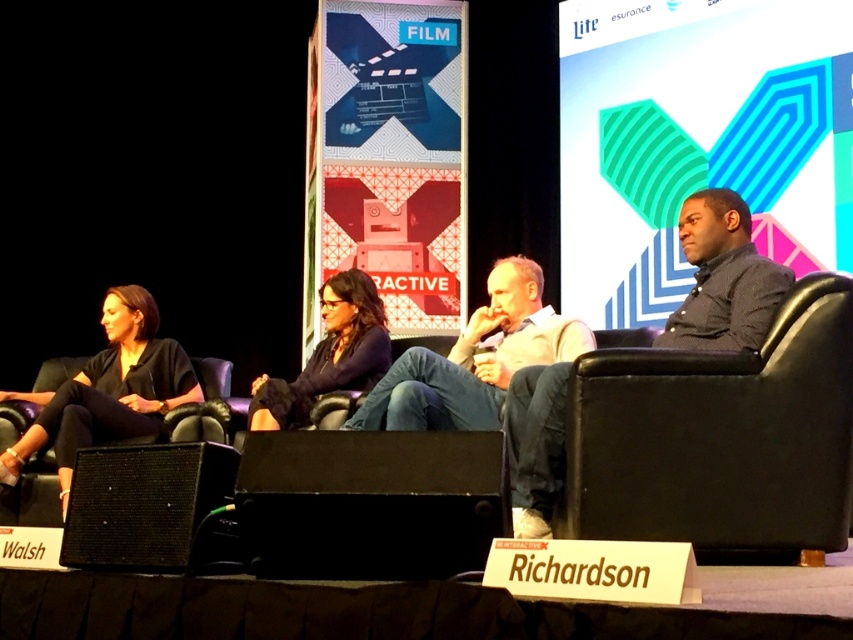
Question: Which point appears farthest from the camera in this image?

Choices:
 (A) (302, 433)
 (B) (114, 372)

Answer: (B)

Question: Considering the real-world distances, which object is farthest from the matte black shirt at center?

Choices:
 (A) dark blue shirt at right
 (B) black matte shirt at left
 (C) light beige sweater at center
 (D) black matte speaker at center

Answer: (D)

Question: From the image, what is the correct spatial relationship of black mesh speaker at lower left in relation to black matte shirt at left?

Choices:
 (A) right
 (B) left

Answer: (A)

Question: Which of the following is the farthest from the observer?

Choices:
 (A) (375, 364)
 (B) (428, 422)

Answer: (A)

Question: Does black matte speaker at center appear on the right side of dark blue shirt at right?

Choices:
 (A) no
 (B) yes

Answer: (A)

Question: Is black matte speaker at center to the right of black mesh speaker at lower left from the viewer's perspective?

Choices:
 (A) no
 (B) yes

Answer: (B)